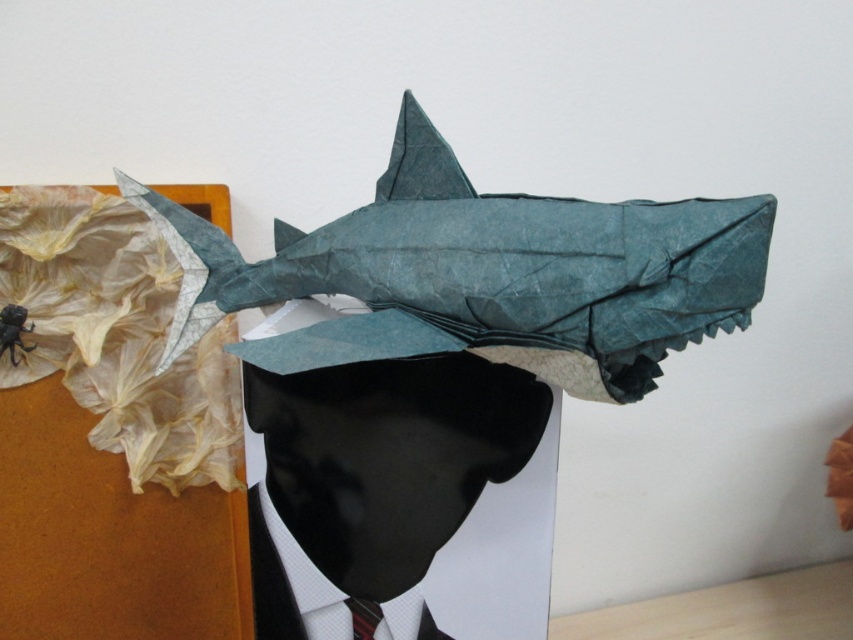
Is matte paper man at center to the right of black fuzzy spider at upper left from the viewer's perspective?

Indeed, matte paper man at center is positioned on the right side of black fuzzy spider at upper left.

Does matte paper man at center have a lesser width compared to black fuzzy spider at upper left?

In fact, matte paper man at center might be wider than black fuzzy spider at upper left.

Locate an element on the screen. matte paper man at center is located at coordinates (401, 499).

Is black fuzzy spider at upper left further to camera compared to red striped tie at center?

Yes, black fuzzy spider at upper left is behind red striped tie at center.

Who is shorter, black fuzzy spider at upper left or red striped tie at center?

red striped tie at center is shorter.

Between point (26, 349) and point (374, 611), which one is positioned behind?

Point (26, 349)

Image resolution: width=853 pixels, height=640 pixels. What are the coordinates of `black fuzzy spider at upper left` in the screenshot? It's located at (13, 330).

Can you confirm if matte paper man at center is smaller than red striped tie at center?

Actually, matte paper man at center might be larger than red striped tie at center.

Is point (415, 368) positioned before point (352, 596)?

Yes, it is in front of point (352, 596).

The image size is (853, 640). I want to click on matte paper man at center, so click(401, 499).